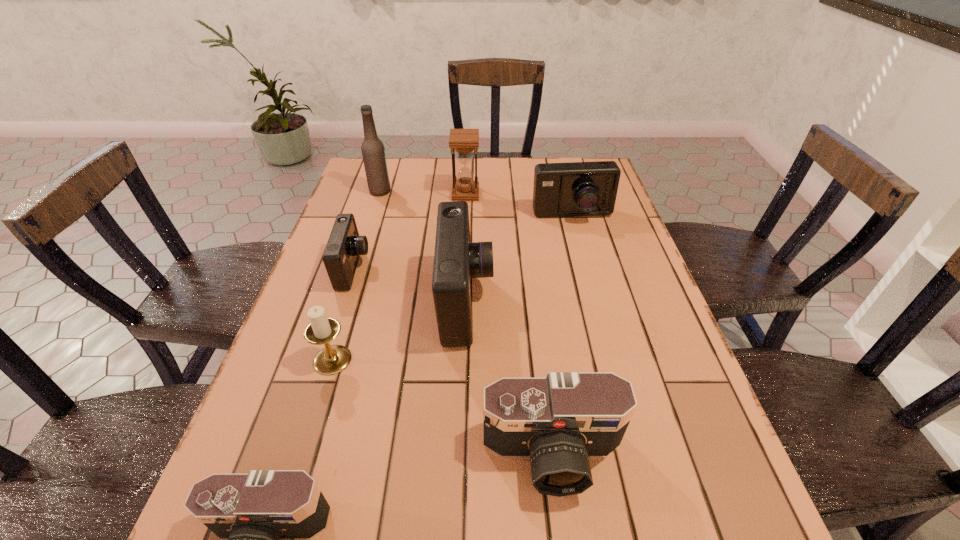
The height and width of the screenshot is (540, 960). I want to click on the tallest object, so click(373, 152).

At what (x,y) coordinates should I click in order to perform the action: click on hourglass. Please return your answer as a coordinate pair (x, y). Image resolution: width=960 pixels, height=540 pixels. Looking at the image, I should click on (464, 141).

At what (x,y) coordinates should I click in order to perform the action: click on the biggest blue camera. Please return your answer as a coordinate pair (x, y). The width and height of the screenshot is (960, 540). Looking at the image, I should click on (457, 260).

Locate an element on the screen. Image resolution: width=960 pixels, height=540 pixels. the second blue camera from right to left is located at coordinates (457, 260).

In order to click on the rightmost blue camera in this screenshot , I will do `click(570, 189)`.

Identify the location of the farthest blue camera. (570, 189).

This screenshot has height=540, width=960. In order to click on white candle holder in this screenshot , I will do click(332, 359).

Where is `the bigger black camera`? the bigger black camera is located at coordinates (559, 422).

Where is `the smallest blue camera`? The image size is (960, 540). the smallest blue camera is located at coordinates (344, 246).

Image resolution: width=960 pixels, height=540 pixels. Find the location of `vacant region located 0.330m on the side of the beer bottle with the label`. vacant region located 0.330m on the side of the beer bottle with the label is located at coordinates (492, 191).